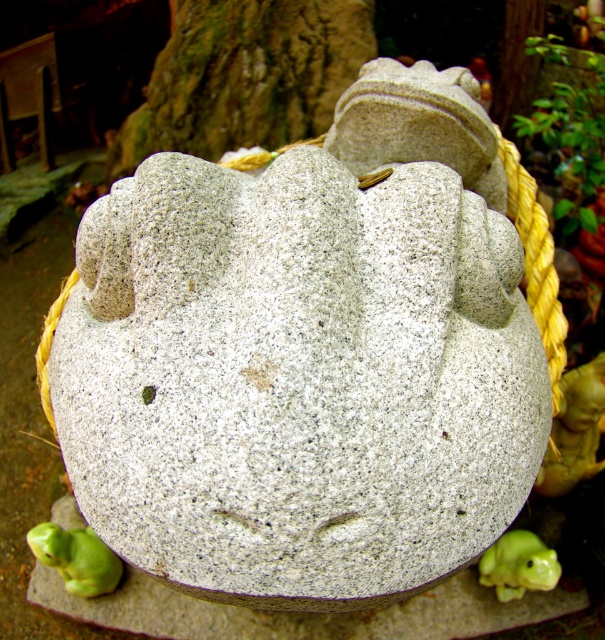
Question: Considering the real-world distances, which object is farthest from the green glazed frog at lower right?

Choices:
 (A) green stone frog at lower left
 (B) gray granite frog at center

Answer: (B)

Question: Which object is positioned farthest from the green stone frog at lower left?

Choices:
 (A) green glazed frog at lower right
 (B) green rubber frog at lower right
 (C) green textured rock at upper center
 (D) gray granite frog at center

Answer: (C)

Question: Does green stone frog at lower left appear under green rubber frog at lower right?

Choices:
 (A) yes
 (B) no

Answer: (B)

Question: Does gray granite stone at center appear over green rubber frog at lower right?

Choices:
 (A) yes
 (B) no

Answer: (B)

Question: Which object appears farthest from the camera in this image?

Choices:
 (A) green rubber frog at lower right
 (B) green textured rock at upper center
 (C) gray granite frog at center
 (D) gray granite stone at center

Answer: (B)

Question: Does granite statue at upper center have a larger size compared to green glazed frog at lower right?

Choices:
 (A) no
 (B) yes

Answer: (A)